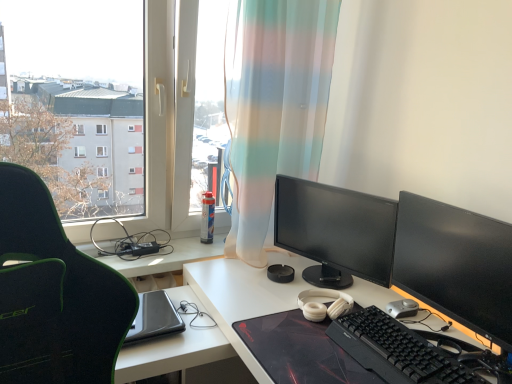
Find the location of a particular element. The image size is (512, 384). vacant area on the back side of black textured mousepad at center is located at coordinates (298, 288).